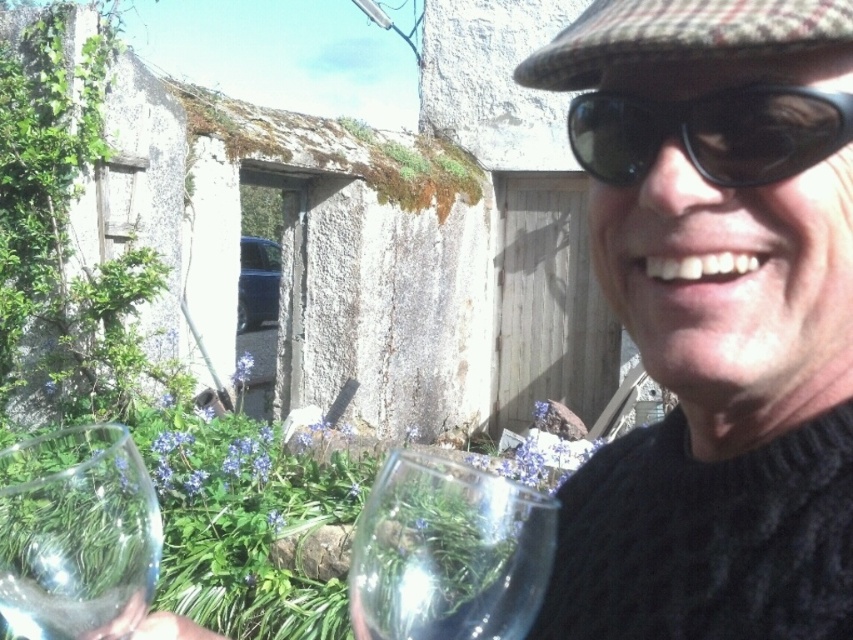
You are a photographer trying to capture a closeup of the transparent glass at lower center without the transparent glass at lower left appearing in the background. Is it possible to achieve this by adjusting your camera angle?

The transparent glass at lower center is positioned over the transparent glass at lower left, so if you angle your camera slightly downward, you can focus on the transparent glass at lower center while blocking the view of the transparent glass at lower left behind it.

You are a photographer setting up for a shoot. You notice the transparent glass at lower center and the black plastic goggles at upper right in the frame. Which object is located to the left of the other?

The transparent glass at lower center is positioned on the left side of black plastic goggles at upper right.

In the scene shown: You are a bartender preparing drinks for a party. You have two glasses in front of you, the transparent glass at lower center and the transparent glass at lower left. You need to pour wine into the taller glass. Which glass should you choose?

The transparent glass at lower left is taller than the transparent glass at lower center, so you should choose the transparent glass at lower left to pour the wine into.